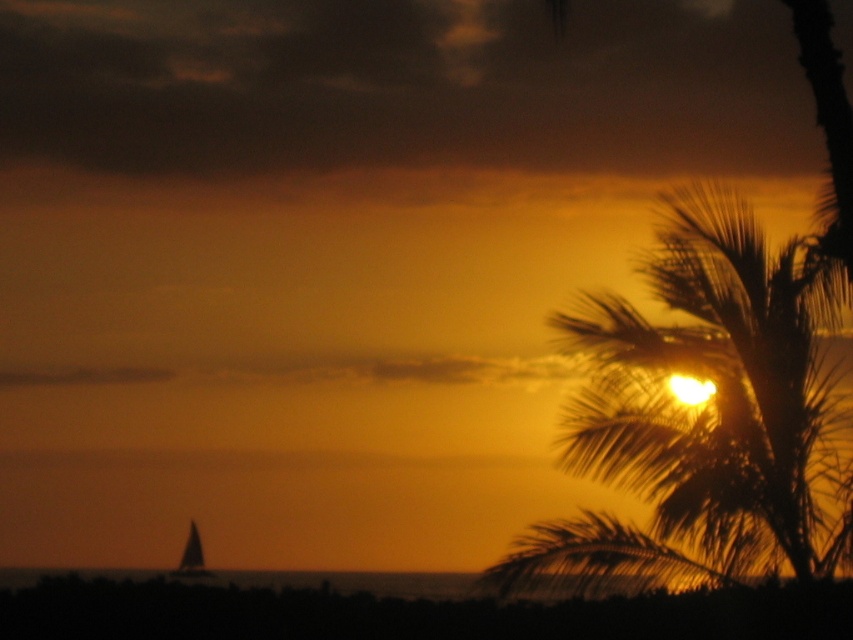
Who is more distant from viewer, (695,378) or (189,566)?

Positioned behind is point (189,566).

Who is more forward, (822, 280) or (195, 563)?

Point (822, 280) is more forward.

Describe the element at coordinates (706, 417) in the screenshot. I see `silhouette leafy palm at upper right` at that location.

The width and height of the screenshot is (853, 640). In order to click on silhouette leafy palm at upper right in this screenshot , I will do click(x=706, y=417).